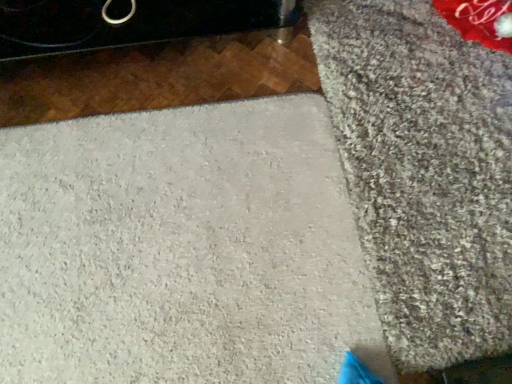
Question: Are white textured concrete at center and gray shaggy carpet at right making contact?

Choices:
 (A) yes
 (B) no

Answer: (B)

Question: Is white textured concrete at center further to the viewer compared to gray shaggy carpet at right?

Choices:
 (A) no
 (B) yes

Answer: (A)

Question: From the image's perspective, is white textured concrete at center on top of gray shaggy carpet at right?

Choices:
 (A) yes
 (B) no

Answer: (B)

Question: Would you consider white textured concrete at center to be distant from gray shaggy carpet at right?

Choices:
 (A) no
 (B) yes

Answer: (A)

Question: Is white textured concrete at center not inside gray shaggy carpet at right?

Choices:
 (A) yes
 (B) no

Answer: (B)

Question: From a real-world perspective, is white textured concrete at center on gray shaggy carpet at right?

Choices:
 (A) no
 (B) yes

Answer: (A)

Question: Could white textured concrete at center be considered to be inside gray shaggy carpet at right?

Choices:
 (A) no
 (B) yes

Answer: (B)

Question: Is gray shaggy carpet at right thinner than white textured concrete at center?

Choices:
 (A) yes
 (B) no

Answer: (A)

Question: Can you confirm if gray shaggy carpet at right is taller than white textured concrete at center?

Choices:
 (A) yes
 (B) no

Answer: (B)

Question: Is gray shaggy carpet at right closer to camera compared to white textured concrete at center?

Choices:
 (A) no
 (B) yes

Answer: (A)

Question: Is gray shaggy carpet at right to the right of white textured concrete at center from the viewer's perspective?

Choices:
 (A) no
 (B) yes

Answer: (B)

Question: Considering the relative sizes of gray shaggy carpet at right and white textured concrete at center in the image provided, is gray shaggy carpet at right shorter than white textured concrete at center?

Choices:
 (A) yes
 (B) no

Answer: (A)

Question: From a real-world perspective, is gray shaggy carpet at right positioned above or below white textured concrete at center?

Choices:
 (A) below
 (B) above

Answer: (B)